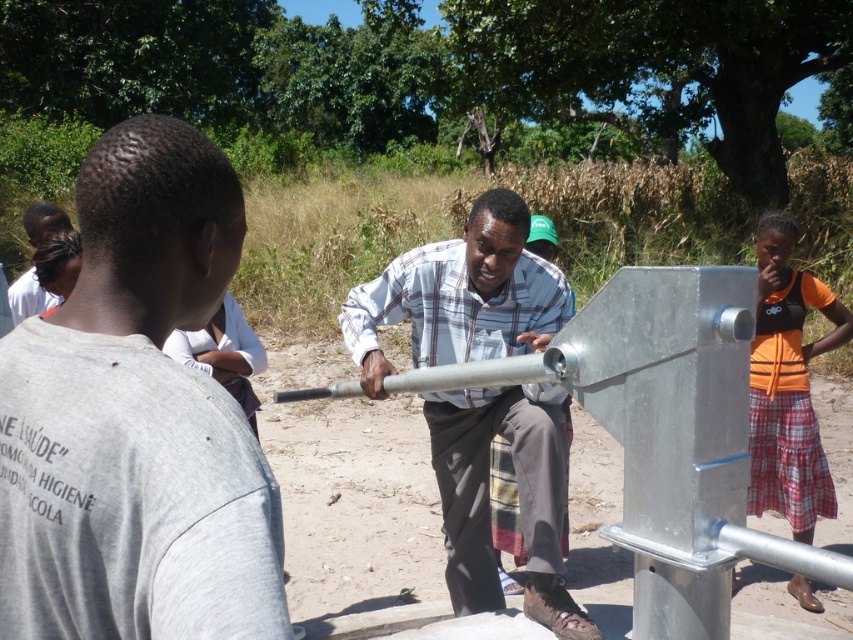
Which is more to the right, orange fabric skirt at lower right or dark brown hair at upper left?

orange fabric skirt at lower right

Which is above, orange fabric skirt at lower right or dark brown hair at upper left?

dark brown hair at upper left is higher up.

Locate an element on the screen. orange fabric skirt at lower right is located at coordinates (787, 384).

This screenshot has height=640, width=853. Describe the element at coordinates (136, 419) in the screenshot. I see `metallic silver water pump at center` at that location.

Can you confirm if metallic silver water pump at center is thinner than metallic silver pipe at center?

Yes.

Is point (248, 548) closer to viewer compared to point (480, 563)?

Yes, it is in front of point (480, 563).

Identify the location of metallic silver water pump at center. The image size is (853, 640). (136, 419).

Which is in front, point (538, 412) or point (57, 209)?

Positioned in front is point (538, 412).

Is metallic silver pipe at center to the left of dark brown hair at upper left from the viewer's perspective?

In fact, metallic silver pipe at center is to the right of dark brown hair at upper left.

Find the location of `metallic silver pipe at center`. metallic silver pipe at center is located at coordinates (460, 296).